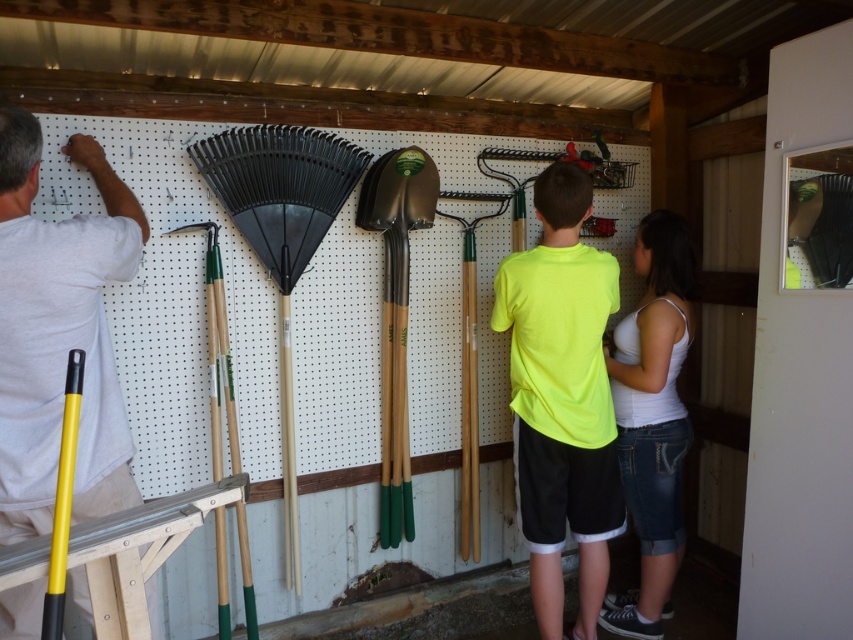
Question: Does white t-shirt at left appear under green wooden shovel at center?

Choices:
 (A) yes
 (B) no

Answer: (A)

Question: Among these objects, which one is nearest to the camera?

Choices:
 (A) white cotton tank top at center
 (B) neon yellow t-shirt at center
 (C) green wooden shovel at center

Answer: (B)

Question: Which of these objects is positioned farthest from the white cotton tank top at center?

Choices:
 (A) white t-shirt at left
 (B) neon yellow t-shirt at center
 (C) green wooden shovel at center

Answer: (A)

Question: Does white t-shirt at left lie in front of neon yellow t-shirt at center?

Choices:
 (A) yes
 (B) no

Answer: (A)

Question: Which object is the closest to the white t-shirt at left?

Choices:
 (A) white cotton tank top at center
 (B) neon yellow t-shirt at center
 (C) green wooden shovel at center

Answer: (C)

Question: Is neon yellow t-shirt at center thinner than white cotton tank top at center?

Choices:
 (A) yes
 (B) no

Answer: (B)